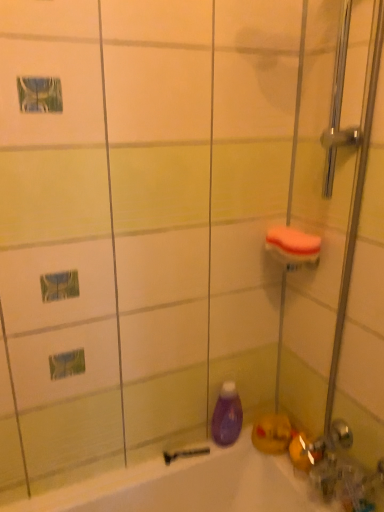
In order to face clear glass shower door at right, should I rotate leftwards or rightwards?

A 16.891 degree turn to the right will do.

Locate an element on the screen. The image size is (384, 512). orange sponge at upper right is located at coordinates (293, 241).

Considering the relative sizes of black rubber razor at lower center and orange sponge at upper right in the image provided, is black rubber razor at lower center smaller than orange sponge at upper right?

Indeed, black rubber razor at lower center has a smaller size compared to orange sponge at upper right.

Between black rubber razor at lower center and orange sponge at upper right, which one has less height?

With less height is black rubber razor at lower center.

Considering the relative sizes of black rubber razor at lower center and orange sponge at upper right in the image provided, is black rubber razor at lower center thinner than orange sponge at upper right?

Indeed, black rubber razor at lower center has a lesser width compared to orange sponge at upper right.

In the scene shown: How different are the orientations of black rubber razor at lower center and orange sponge at upper right in degrees?

89.6 degrees separate the facing orientations of black rubber razor at lower center and orange sponge at upper right.

From a real-world perspective, is clear glass shower door at right below purple glossy bottle at lower center?

Incorrect, from a real-world perspective, clear glass shower door at right is higher than purple glossy bottle at lower center.

Which object is further away from the camera taking this photo, clear glass shower door at right or purple glossy bottle at lower center?

Positioned behind is purple glossy bottle at lower center.

Can you confirm if clear glass shower door at right is taller than purple glossy bottle at lower center?

Correct, clear glass shower door at right is much taller as purple glossy bottle at lower center.

How distant is clear glass shower door at right from purple glossy bottle at lower center?

clear glass shower door at right and purple glossy bottle at lower center are 19.47 inches apart from each other.

Is black rubber razor at lower center situated inside purple glossy bottle at lower center or outside?

black rubber razor at lower center is not enclosed by purple glossy bottle at lower center.

How distant is black rubber razor at lower center from purple glossy bottle at lower center?

black rubber razor at lower center and purple glossy bottle at lower center are 4.73 inches apart from each other.

From the image's perspective, who appears lower, black rubber razor at lower center or purple glossy bottle at lower center?

black rubber razor at lower center appears lower in the image.

Considering the relative sizes of black rubber razor at lower center and purple glossy bottle at lower center in the image provided, is black rubber razor at lower center thinner than purple glossy bottle at lower center?

Correct, the width of black rubber razor at lower center is less than that of purple glossy bottle at lower center.

Is orange sponge at upper right taller than black rubber razor at lower center?

Correct, orange sponge at upper right is much taller as black rubber razor at lower center.

Relative to black rubber razor at lower center, is orange sponge at upper right in front or behind?

In the image, orange sponge at upper right appears in front of black rubber razor at lower center.

Consider the image. Does orange sponge at upper right turn towards black rubber razor at lower center?

No, orange sponge at upper right is not oriented towards black rubber razor at lower center.

Is purple glossy bottle at lower center thinner than black rubber razor at lower center?

No.

Is purple glossy bottle at lower center aimed at black rubber razor at lower center?

No, purple glossy bottle at lower center is not oriented towards black rubber razor at lower center.

Is point (221, 417) farther from viewer compared to point (184, 451)?

Yes.

Image resolution: width=384 pixels, height=512 pixels. Find the location of `cleaning product that appears above the black rubber razor at lower center (from the image's perspective)`. cleaning product that appears above the black rubber razor at lower center (from the image's perspective) is located at coordinates (227, 415).

Is orange sponge at upper right with purple glossy bottle at lower center?

They are not placed beside each other.

Is orange sponge at upper right smaller than purple glossy bottle at lower center?

Correct, orange sponge at upper right occupies less space than purple glossy bottle at lower center.

Considering the relative sizes of orange sponge at upper right and purple glossy bottle at lower center in the image provided, is orange sponge at upper right thinner than purple glossy bottle at lower center?

In fact, orange sponge at upper right might be wider than purple glossy bottle at lower center.

Does clear glass shower door at right have a lesser width compared to black rubber razor at lower center?

Incorrect, the width of clear glass shower door at right is not less than that of black rubber razor at lower center.

Identify the location of shower below the clear glass shower door at right (from a real-world perspective). (185, 454).

From their relative heights in the image, would you say clear glass shower door at right is taller or shorter than black rubber razor at lower center?

clear glass shower door at right is taller than black rubber razor at lower center.

From the image's perspective, is clear glass shower door at right under black rubber razor at lower center?

Incorrect, from the image's perspective, clear glass shower door at right is higher than black rubber razor at lower center.

You are a GUI agent. You are given a task and a screenshot of the screen. Output one action in this format:
    pyautogui.click(x=<x>, y=<y>)
    Task: Click on the shower beneath the orange sponge at upper right (from a real-world perspective)
    Image resolution: width=384 pixels, height=512 pixels.
    Given the screenshot: What is the action you would take?
    pyautogui.click(x=185, y=454)

Find the location of a particular element. This screenshot has height=512, width=384. cleaning product on the left side of clear glass shower door at right is located at coordinates (227, 415).

Based on their spatial positions, is clear glass shower door at right or black rubber razor at lower center closer to purple glossy bottle at lower center?

Among the two, black rubber razor at lower center is located nearer to purple glossy bottle at lower center.

Which object lies further to the anchor point orange sponge at upper right, purple glossy bottle at lower center or clear glass shower door at right?

Based on the image, purple glossy bottle at lower center appears to be further to orange sponge at upper right.

Considering their positions, is black rubber razor at lower center positioned closer to orange sponge at upper right than clear glass shower door at right?

clear glass shower door at right lies closer to orange sponge at upper right than the other object.

From the picture: Looking at the image, which one is located further to orange sponge at upper right, clear glass shower door at right or purple glossy bottle at lower center?

purple glossy bottle at lower center is further to orange sponge at upper right.

Looking at this image, from the image, which object appears to be farther from orange sponge at upper right, black rubber razor at lower center or purple glossy bottle at lower center?

Based on the image, black rubber razor at lower center appears to be further to orange sponge at upper right.

Based on their spatial positions, is black rubber razor at lower center or purple glossy bottle at lower center further from clear glass shower door at right?

black rubber razor at lower center.

Considering their positions, is clear glass shower door at right positioned further to black rubber razor at lower center than purple glossy bottle at lower center?

The object further to black rubber razor at lower center is clear glass shower door at right.

When comparing their distances from clear glass shower door at right, does orange sponge at upper right or purple glossy bottle at lower center seem further?

Among the two, purple glossy bottle at lower center is located further to clear glass shower door at right.

The height and width of the screenshot is (512, 384). Identify the location of soap between clear glass shower door at right and black rubber razor at lower center along the z-axis. (293, 241).

You are a GUI agent. You are given a task and a screenshot of the screen. Output one action in this format:
    pyautogui.click(x=<x>, y=<y>)
    Task: Click on the soap between clear glass shower door at right and purple glossy bottle at lower center along the z-axis
    
    Given the screenshot: What is the action you would take?
    pyautogui.click(x=293, y=241)

Identify the location of cleaning product between orange sponge at upper right and black rubber razor at lower center in the vertical direction. This screenshot has width=384, height=512. (227, 415).

Find the location of a particular element. This screenshot has width=384, height=512. cleaning product between clear glass shower door at right and black rubber razor at lower center from front to back is located at coordinates (227, 415).